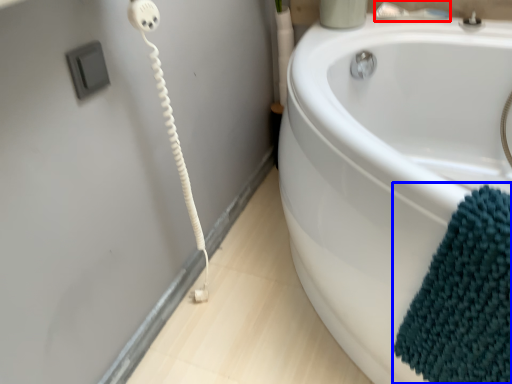
Question: Which of the following is the farthest to the observer, faucet (highlighted by a red box) or bath towel (highlighted by a blue box)?

Choices:
 (A) faucet
 (B) bath towel

Answer: (A)